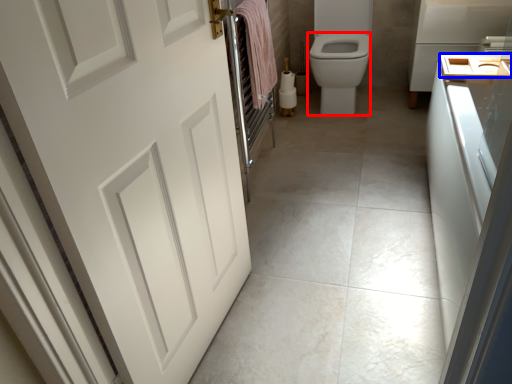
Question: Among these objects, which one is nearest to the camera, bidet (highlighted by a red box) or sink (highlighted by a blue box)?

Choices:
 (A) bidet
 (B) sink

Answer: (B)